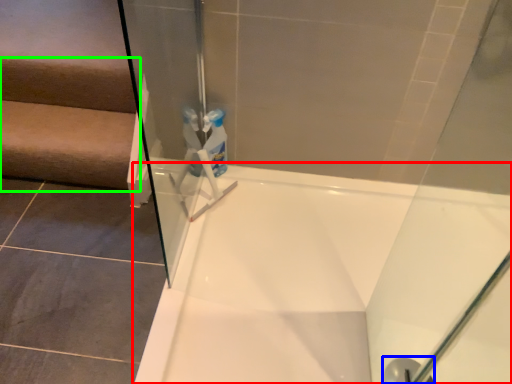
Question: Based on their relative distances, which object is nearer to bathtub (highlighted by a red box)? Choose from shower (highlighted by a blue box) and stairwell (highlighted by a green box).

Choices:
 (A) shower
 (B) stairwell

Answer: (A)